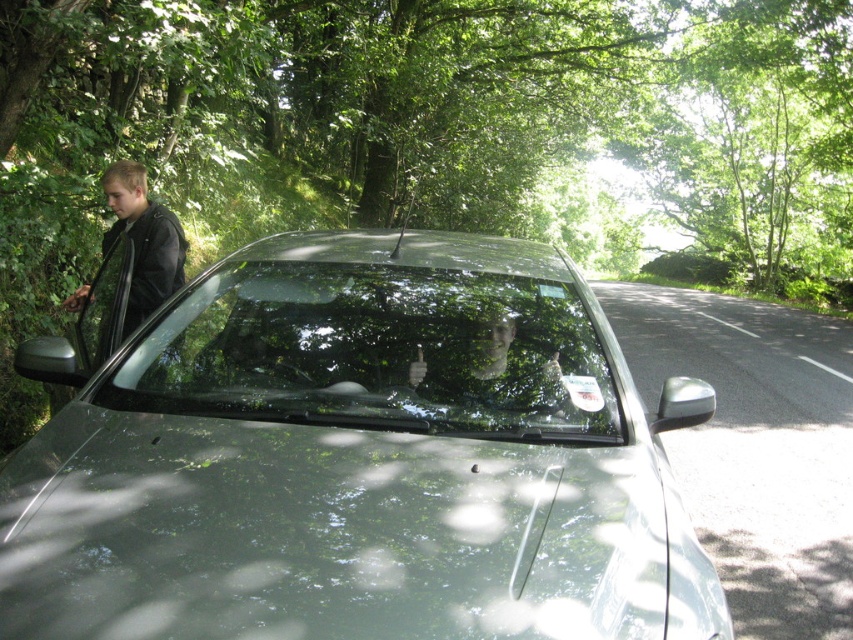
You are standing at the point marked as point [679,596] and want to take a photo of the car parked on the side of the road. The camera you are using has a focal length of 50mm. What is the minimum distance you need to be from the car to ensure the entire car fits in the frame?

The point marked as point [679,596] is 1.64 meters away from the viewer. To ensure the entire car fits in the frame with a 50mm focal length, you need to be at least 1.64 meters away from the car.

You are a pedestrian standing on the sidewalk and looking at the car with the green leafy tree at upper center and the clear glass windshield at center. Which object is closer to you?

Result: The green leafy tree at upper center is closer to you than the clear glass windshield at center because it is positioned further to the viewer.